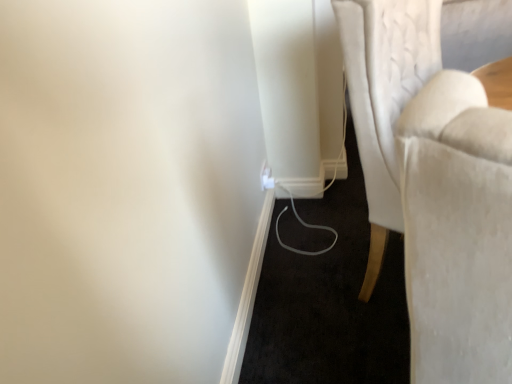
Measure the distance between velvet white armchair at right and camera.

velvet white armchair at right and camera are 37.56 inches apart from each other.

Image resolution: width=512 pixels, height=384 pixels. Find the location of `velvet white armchair at right`. velvet white armchair at right is located at coordinates (385, 97).

This screenshot has width=512, height=384. Describe the element at coordinates (385, 97) in the screenshot. I see `velvet white armchair at right` at that location.

You are a GUI agent. You are given a task and a screenshot of the screen. Output one action in this format:
    pyautogui.click(x=<x>, y=<y>)
    Task: Click on the velvet white armchair at right
    The image size is (512, 384).
    Given the screenshot: What is the action you would take?
    pyautogui.click(x=385, y=97)